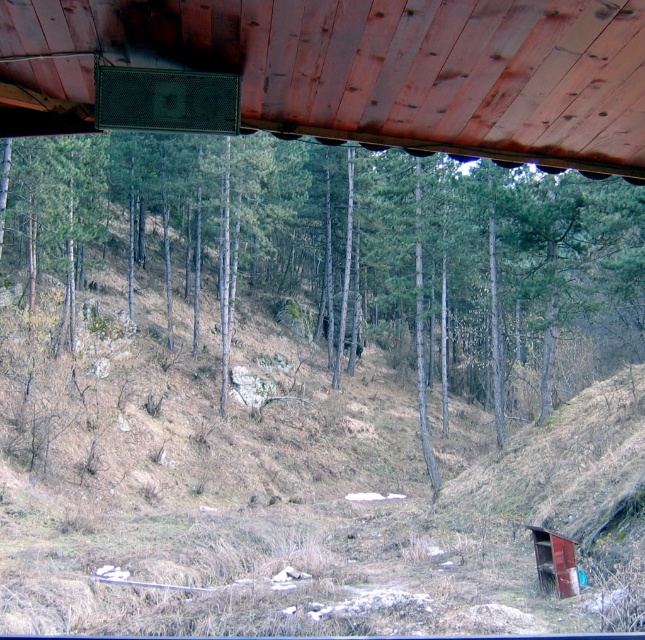
Question: Among these points, which one is farthest from the camera?

Choices:
 (A) (508, 108)
 (B) (63, 161)

Answer: (B)

Question: Which object appears closest to the camera in this image?

Choices:
 (A) green leafy tree at center
 (B) wooden ceiling at upper center

Answer: (B)

Question: Can you confirm if green leafy tree at center is bigger than wooden ceiling at upper center?

Choices:
 (A) no
 (B) yes

Answer: (B)

Question: Which object is farther from the camera taking this photo?

Choices:
 (A) green leafy tree at center
 (B) wooden ceiling at upper center

Answer: (A)

Question: Is green leafy tree at center wider than wooden ceiling at upper center?

Choices:
 (A) no
 (B) yes

Answer: (B)

Question: Can you confirm if green leafy tree at center is positioned above wooden ceiling at upper center?

Choices:
 (A) no
 (B) yes

Answer: (B)